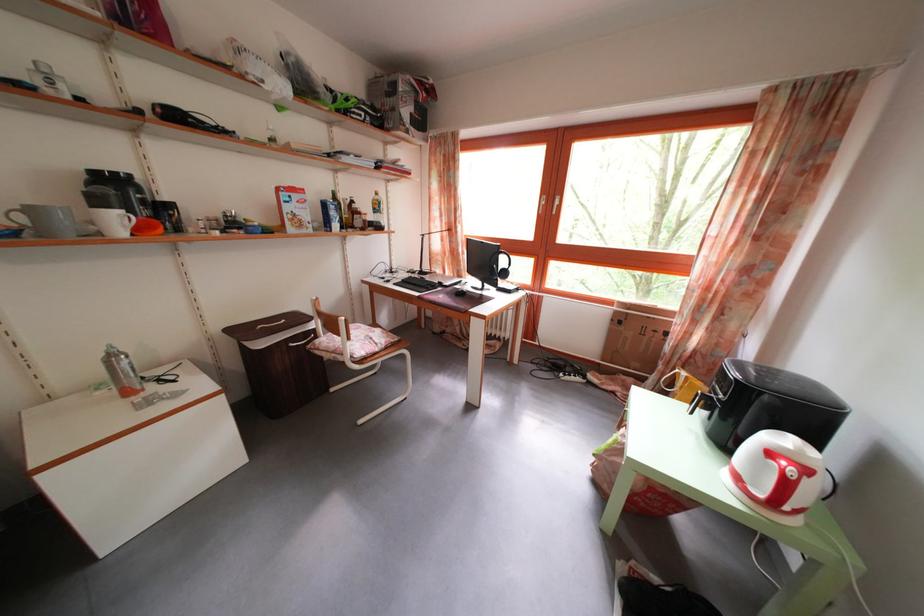
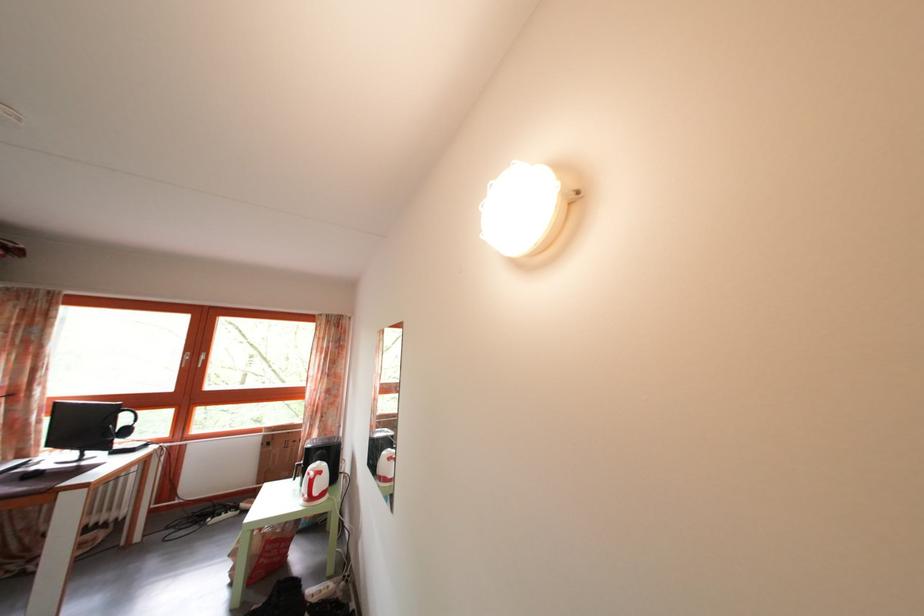
In the second image, find the point that corresponds to point 696,341 in the first image.

(317, 442)